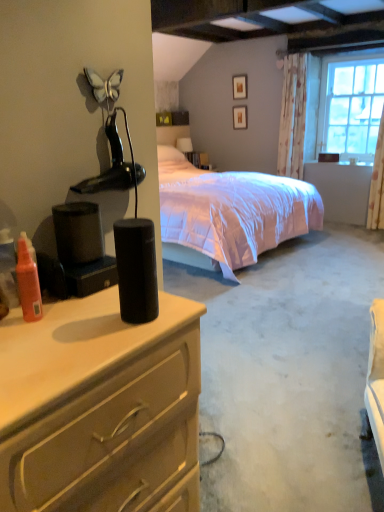
Find the location of `vacant area situated to the left side of black matte speaker at center`. vacant area situated to the left side of black matte speaker at center is located at coordinates (72, 322).